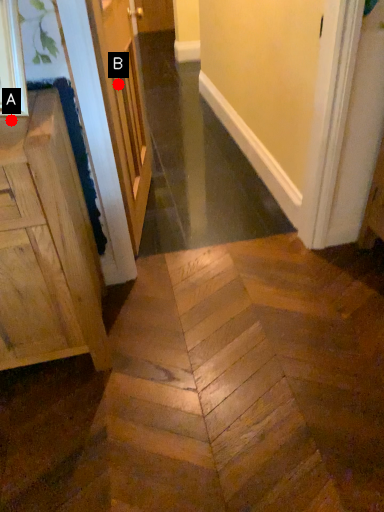
Question: Two points are circled on the image, labeled by A and B beside each circle. Among these points, which one is nearest to the camera?

Choices:
 (A) A is closer
 (B) B is closer

Answer: (A)